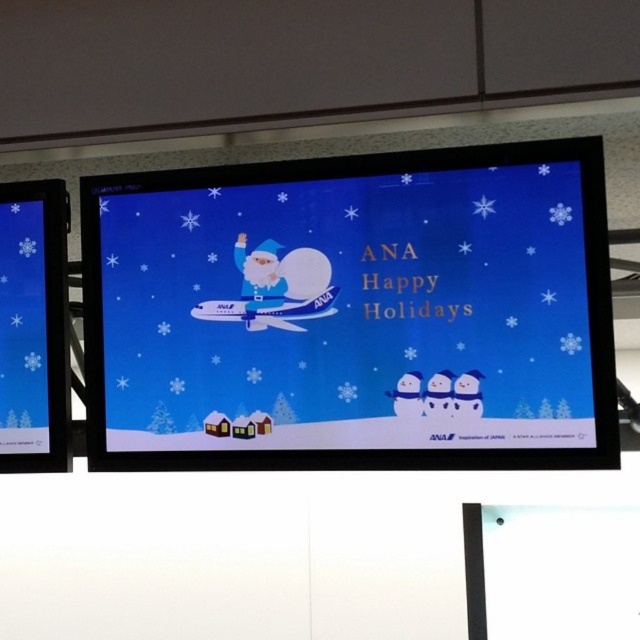
You are standing in front of the digital display screen and want to locate the ANA advertisement. Which object is positioned to the right of the other between the blue glossy screen at center and the matte blue santa at center?

The blue glossy screen at center is to the right of the matte blue santa at center.

You are an airport employee checking the digital displays. You see the blue glossy screen at center and the blue glossy screen at left. Which one is positioned higher up on the wall?

The blue glossy screen at center is positioned higher up on the wall because it is located above the blue glossy screen at left.

You are designing a poster and need to ensure that the blue glossy screen at center and the matte blue santa at center are proportionally sized. According to the scene description, which object should be made larger in the poster design?

The blue glossy screen at center should be made larger in the poster design since it is described as having a larger size compared to the matte blue santa at center.